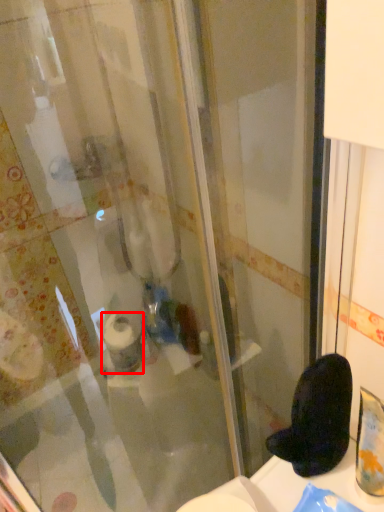
Question: From the image's perspective, where is toilet paper (annotated by the red box) located in relation to footwear in the image?

Choices:
 (A) below
 (B) above

Answer: (A)